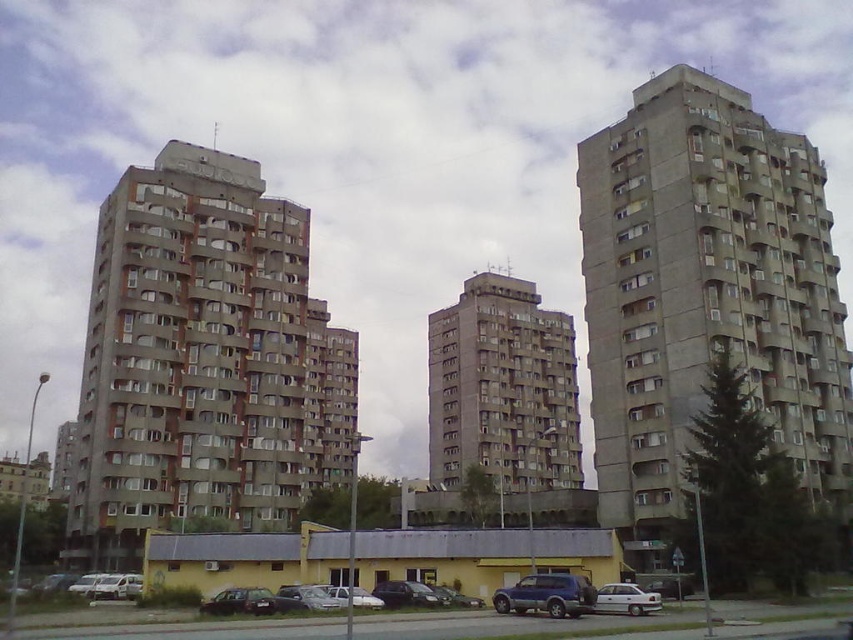
How distant is gray concrete building at center from silver metallic car at lower left?

44.73 meters

Is point (712, 136) less distant than point (137, 589)?

No, it is not.

Who is more distant from viewer, (750, 179) or (103, 596)?

The point (750, 179) is more distant.

Identify the location of gray concrete building at center. This screenshot has width=853, height=640. (706, 296).

Is concrete building at center to the right of metallic blue suv at center from the viewer's perspective?

No, concrete building at center is not to the right of metallic blue suv at center.

Locate an element on the screen. The image size is (853, 640). concrete building at center is located at coordinates (202, 362).

What do you see at coordinates (202, 362) in the screenshot? This screenshot has width=853, height=640. I see `concrete building at center` at bounding box center [202, 362].

You are a GUI agent. You are given a task and a screenshot of the screen. Output one action in this format:
    pyautogui.click(x=<x>, y=<y>)
    Task: Click on the concrete building at center
    Image resolution: width=853 pixels, height=640 pixels.
    Given the screenshot: What is the action you would take?
    pyautogui.click(x=202, y=362)

Is concrete block building at center taller than white matte car at lower center?

Yes.

Is concrete block building at center bigger than white matte car at lower center?

Correct, concrete block building at center is larger in size than white matte car at lower center.

Identify the location of concrete block building at center. (502, 388).

Identify the location of concrete block building at center. (502, 388).